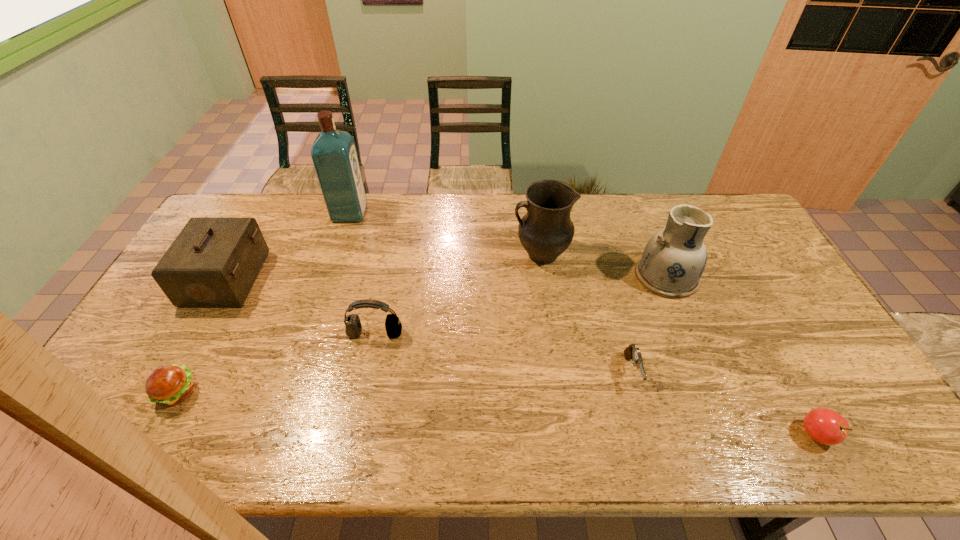
Point out which object is positioned as the third nearest to the fifth tallest object. Please provide its 2D coordinates. Your answer should be formatted as a tuple, i.e. [(x, y)], where the tuple contains the x and y coordinates of a point satisfying the conditions above.

[(546, 231)]

Where is `object that is the third closest to the tallest object`? The image size is (960, 540). object that is the third closest to the tallest object is located at coordinates (546, 231).

The width and height of the screenshot is (960, 540). I want to click on free spot that satisfies the following two spatial constraints: 1. on the handle side of the pitcher; 2. on the right side of the apple, so click(x=565, y=434).

Identify the location of vacant space that satisfies the following two spatial constraints: 1. on the handle side of the pottery; 2. on the left side of the pitcher. (543, 276).

Identify the location of free spot that satisfies the following two spatial constraints: 1. on the flat label side of the farthest object; 2. on the right side of the seventh object from left to right. This screenshot has height=540, width=960. (329, 276).

Locate an element on the screen. This screenshot has height=540, width=960. free space that satisfies the following two spatial constraints: 1. on the headband of the fifth farthest object; 2. on the left side of the rightmost object is located at coordinates (354, 434).

This screenshot has width=960, height=540. What are the coordinates of `free region that satisfies the following two spatial constraints: 1. at the barrel of the apple; 2. on the right side of the pistol` in the screenshot? It's located at coord(649,434).